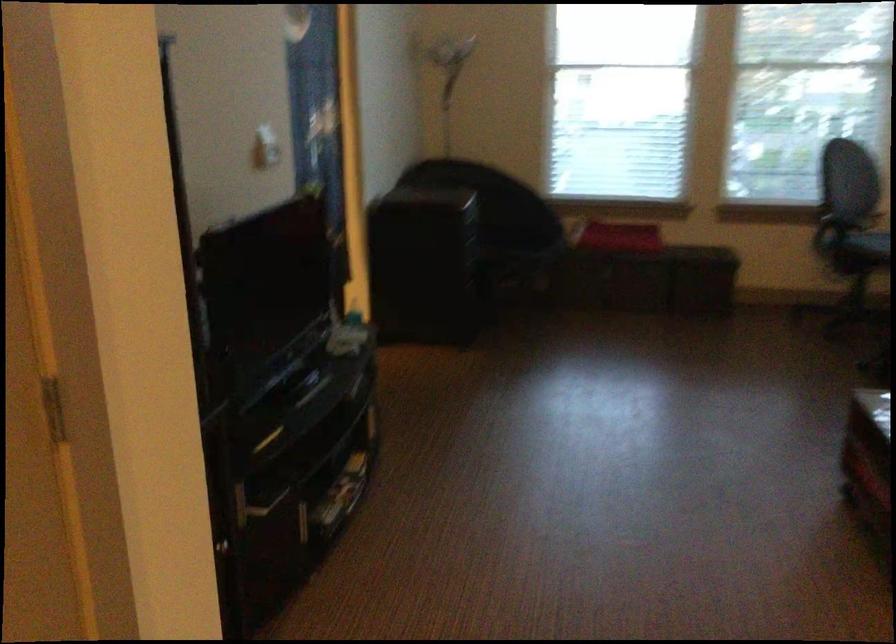
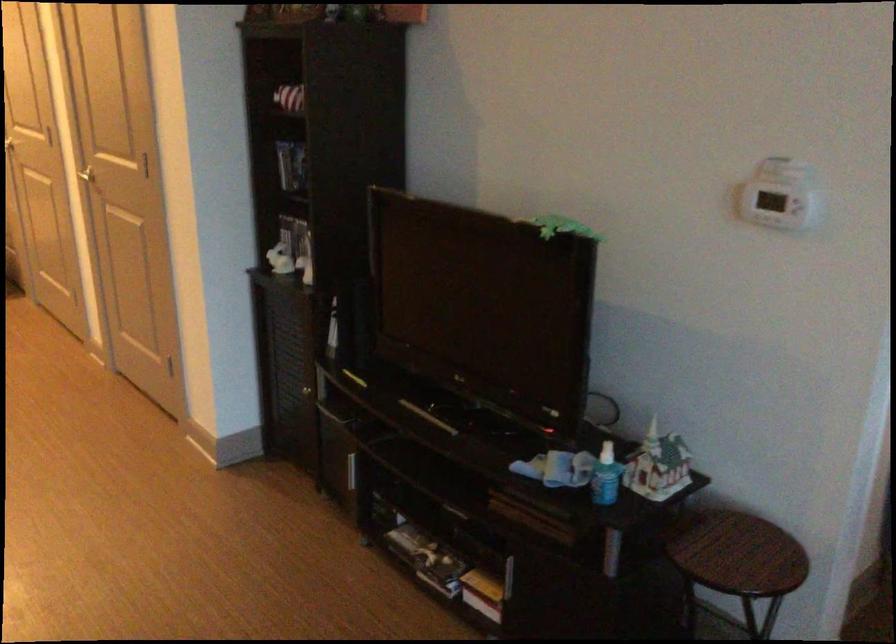
The point at (363, 323) is marked in the first image. Where is the corresponding point in the second image?

(606, 476)